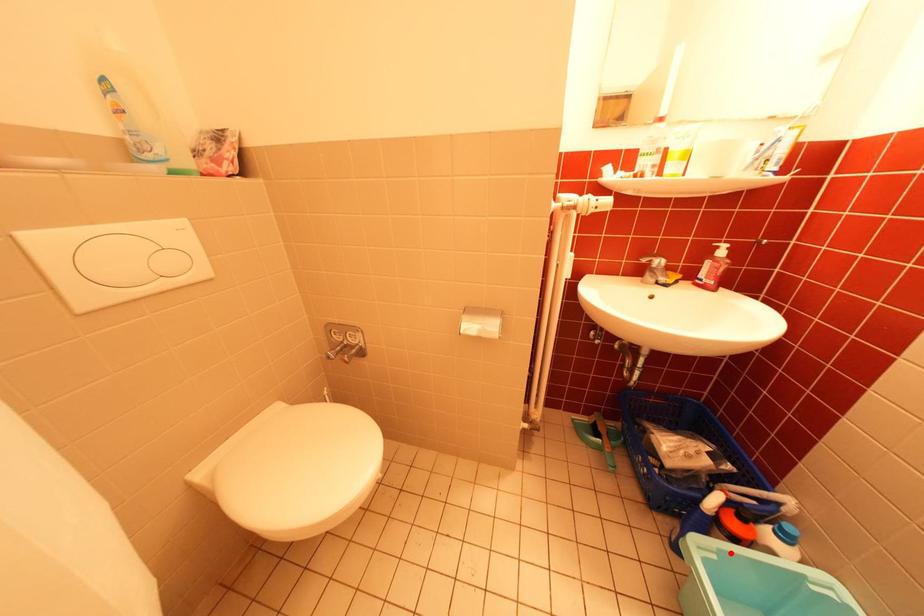
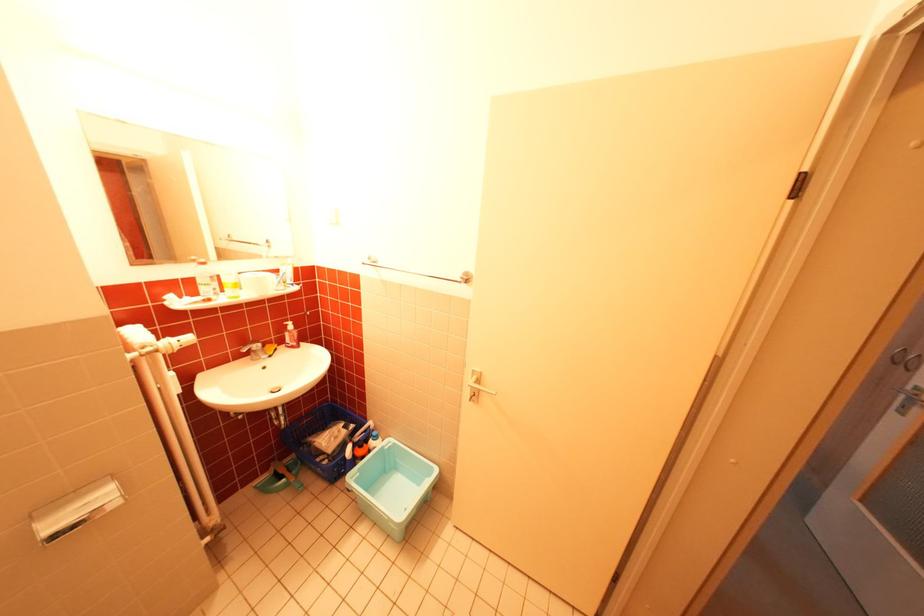
Question: I am providing you with two images of the same scene from different viewpoints. In image1, a red point is highlighted. Considering the same 3D point in image2, which of the following is correct?

Choices:
 (A) It is closer
 (B) It is farther

Answer: (B)